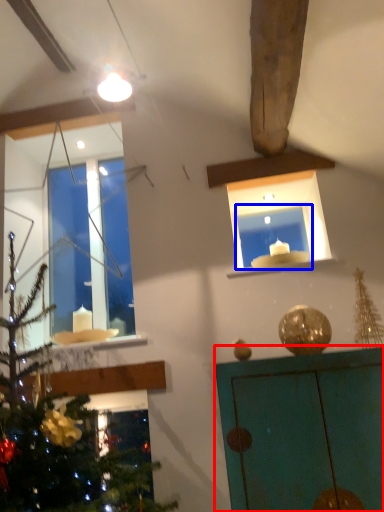
Question: Which of the following is the farthest to the observer, furniture (highlighted by a red box) or window frame (highlighted by a blue box)?

Choices:
 (A) furniture
 (B) window frame

Answer: (B)